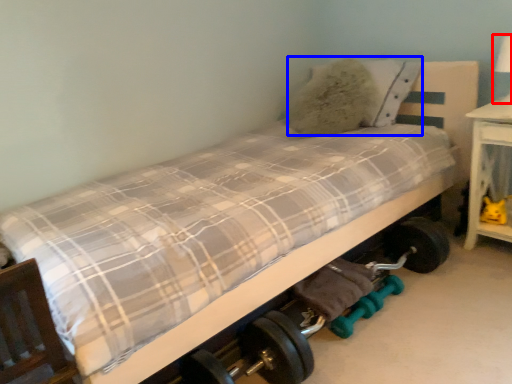
Question: Which object is further to the camera taking this photo, table lamp (highlighted by a red box) or pillow (highlighted by a blue box)?

Choices:
 (A) table lamp
 (B) pillow

Answer: (B)